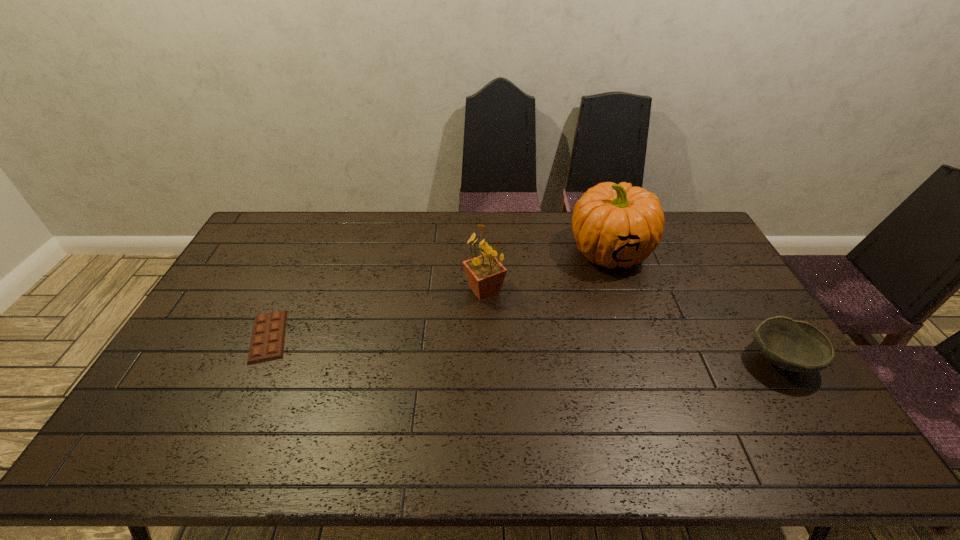
What are the coordinates of `vacant position in the image that satisfies the following two spatial constraints: 1. on the back side of the shortest object; 2. on the left side of the pumpkin` in the screenshot? It's located at (308, 251).